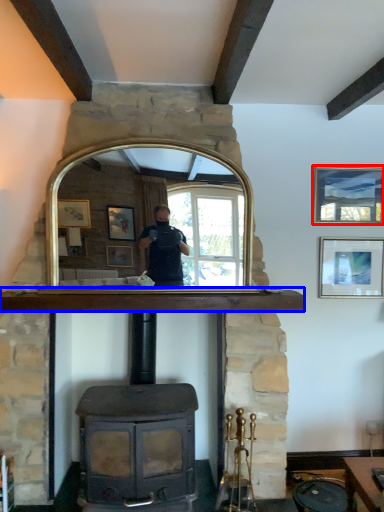
Question: Among these objects, which one is nearest to the camera, picture frame (highlighted by a red box) or mantle (highlighted by a blue box)?

Choices:
 (A) picture frame
 (B) mantle

Answer: (B)